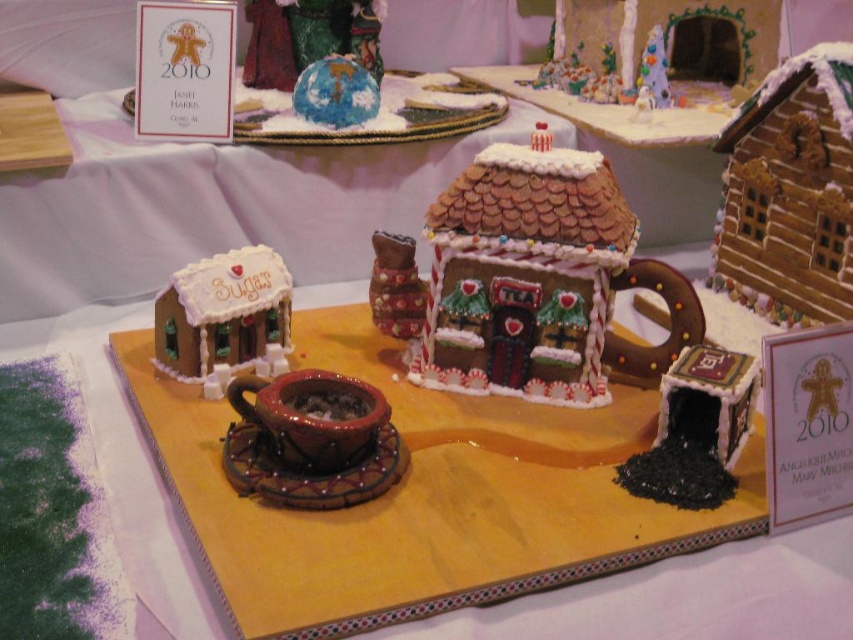
You are a judge at the gingerbread competition. You need to determine which of the two houses is taller to award a prize for height. The two houses are the white sugary house at lower left and the matte brown gingerbread house at center. Based on the display, which one should win?

The white sugary house at lower left is taller than the matte brown gingerbread house at center, so it should win the prize for height.

You are a judge standing at the front of the gingerbread display. You need to inspect two points marked on the display. The first point is at coordinate point (257, 353) and the second is at point (405, 320). Which point is closer to you?

Point (257, 353) is in front of point (405, 320), so the first point is closer to you.